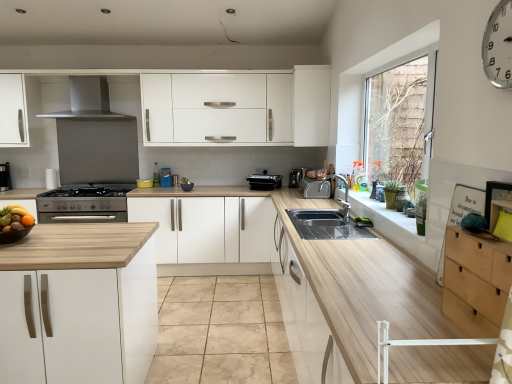
Find the location of a particular element. vacant area that is in front of satin silver toaster at center is located at coordinates (311, 202).